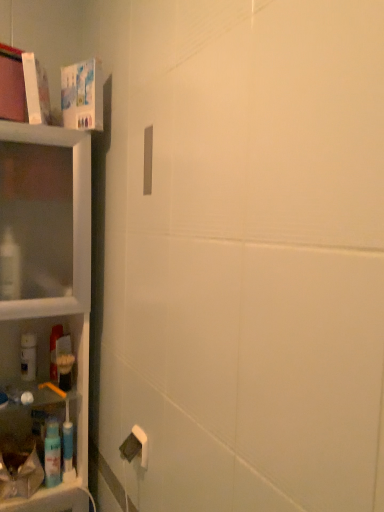
Question: Is translucent plastic mouthwash at lower left behind clear plastic shelf at left?

Choices:
 (A) no
 (B) yes

Answer: (B)

Question: Can you confirm if translucent plastic mouthwash at lower left is smaller than clear plastic shelf at left?

Choices:
 (A) no
 (B) yes

Answer: (B)

Question: Is translucent plastic mouthwash at lower left not within clear plastic shelf at left?

Choices:
 (A) no
 (B) yes

Answer: (A)

Question: Considering the relative sizes of translucent plastic mouthwash at lower left and clear plastic shelf at left in the image provided, is translucent plastic mouthwash at lower left thinner than clear plastic shelf at left?

Choices:
 (A) yes
 (B) no

Answer: (A)

Question: From the image's perspective, would you say translucent plastic mouthwash at lower left is positioned over clear plastic shelf at left?

Choices:
 (A) no
 (B) yes

Answer: (A)

Question: From a real-world perspective, relative to translucent plastic mouthwash at lower left, is white matte bottle at left, placed as the second cleaning product when sorted from front to back, vertically above or below?

Choices:
 (A) above
 (B) below

Answer: (B)

Question: In the image, is white matte bottle at left, which is counted as the 1th cleaning product, starting from the back, positioned in front of or behind translucent plastic mouthwash at lower left?

Choices:
 (A) front
 (B) behind

Answer: (A)

Question: Is white matte bottle at left, which is the second cleaning product from bottom to top, taller or shorter than translucent plastic mouthwash at lower left?

Choices:
 (A) short
 (B) tall

Answer: (A)

Question: In terms of width, does white matte bottle at left, placed as the second cleaning product when sorted from front to back, look wider or thinner when compared to translucent plastic mouthwash at lower left?

Choices:
 (A) thin
 (B) wide

Answer: (A)

Question: From the image's perspective, is translucent plastic mouthwash at lower left above or below white matte bottle at left, the second cleaning product positioned from the right?

Choices:
 (A) above
 (B) below

Answer: (A)

Question: In terms of height, does translucent plastic mouthwash at lower left look taller or shorter compared to white matte bottle at left, the second cleaning product positioned from the right?

Choices:
 (A) short
 (B) tall

Answer: (B)

Question: Based on their positions, is translucent plastic mouthwash at lower left located to the left or right of white matte bottle at left, the second cleaning product positioned from the right?

Choices:
 (A) left
 (B) right

Answer: (B)

Question: Is translucent plastic mouthwash at lower left situated inside white matte bottle at left, which is the second cleaning product from bottom to top, or outside?

Choices:
 (A) outside
 (B) inside

Answer: (A)

Question: From a real-world perspective, relative to blue plastic spray bottle at left, which is the 1th cleaning product from bottom to top, is clear plastic shelf at left vertically above or below?

Choices:
 (A) below
 (B) above

Answer: (B)

Question: From the image's perspective, is clear plastic shelf at left located above or below blue plastic spray bottle at left, which is counted as the first cleaning product, starting from the front?

Choices:
 (A) below
 (B) above

Answer: (B)